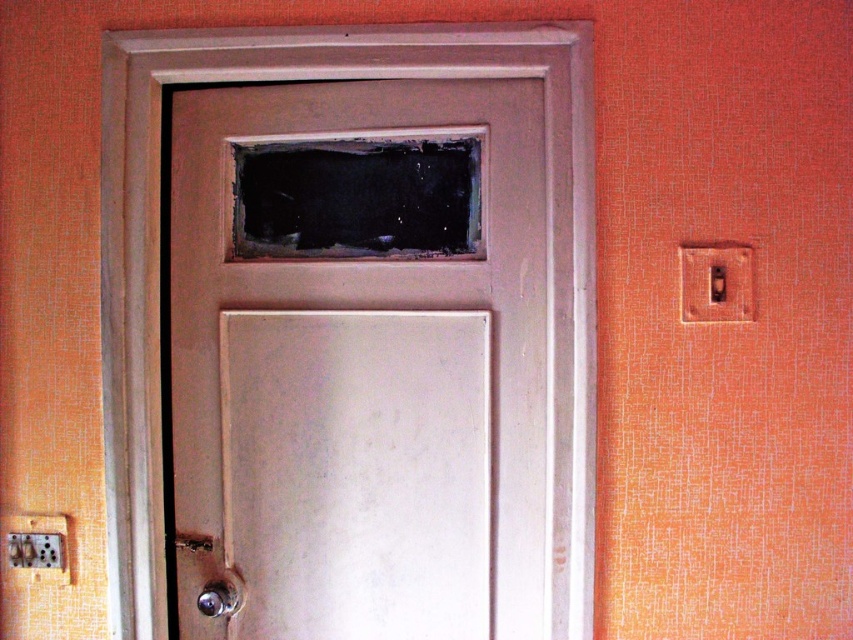
You are trying to open the door by using your hand. Which object, the polished silver knob at lower left or the metallic silver door handle at lower left, requires a wider grip to grasp?

The polished silver knob at lower left requires a wider grip to grasp because its width surpasses that of the metallic silver door handle at lower left.